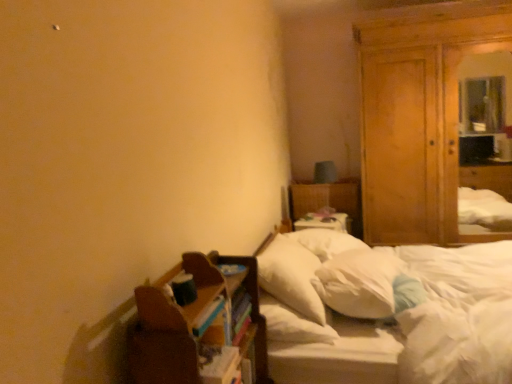
What do you see at coordinates (328, 201) in the screenshot?
I see `white fabric bed at center` at bounding box center [328, 201].

You are a GUI agent. You are given a task and a screenshot of the screen. Output one action in this format:
    pyautogui.click(x=<x>, y=<y>)
    Task: Click on the white soft mattress at center
    The image size is (512, 384).
    Given the screenshot: What is the action you would take?
    pyautogui.click(x=459, y=315)

The image size is (512, 384). Identify the location of white soft bed at center. (390, 311).

What do you see at coordinates (224, 319) in the screenshot? The image size is (512, 384). I see `multicolored paper book at center` at bounding box center [224, 319].

Where is `white fabric bed at center`? white fabric bed at center is located at coordinates (328, 201).

Considering the sizes of objects white soft bed at center and white fabric bed at center in the image provided, who is taller, white soft bed at center or white fabric bed at center?

With more height is white soft bed at center.

Looking at this image, in terms of width, does white soft bed at center look wider or thinner when compared to white fabric bed at center?

Clearly, white soft bed at center has more width compared to white fabric bed at center.

From a real-world perspective, who is located lower, white soft bed at center or white fabric bed at center?

white soft bed at center is physically lower.

Is white soft bed at center at the left side of white fabric bed at center?

Incorrect, white soft bed at center is not on the left side of white fabric bed at center.

From the image's perspective, which is above, white soft mattress at center or multicolored paper book at center?

From the image's view, multicolored paper book at center is above.

Can you confirm if white soft mattress at center is wider than multicolored paper book at center?

Correct, the width of white soft mattress at center exceeds that of multicolored paper book at center.

Is white soft mattress at center inside or outside of multicolored paper book at center?

white soft mattress at center is spatially situated outside multicolored paper book at center.

From a real-world perspective, is brown wooden shelf at lower left over white soft pillow at center, the 2th pillow viewed from the left?

Correct, in the physical world, brown wooden shelf at lower left is higher than white soft pillow at center, the 2th pillow viewed from the left.

Is brown wooden shelf at lower left shorter than white soft pillow at center, arranged as the 1th pillow when viewed from the right?

In fact, brown wooden shelf at lower left may be taller than white soft pillow at center, arranged as the 1th pillow when viewed from the right.

Based on their positions, is brown wooden shelf at lower left located to the left or right of white soft pillow at center, the 2th pillow viewed from the left?

brown wooden shelf at lower left is positioned on white soft pillow at center, the 2th pillow viewed from the left,'s left side.

Find the location of a particular element. The width and height of the screenshot is (512, 384). the 2nd pillow to the right of the brown wooden shelf at lower left, starting your count from the anchor is located at coordinates (360, 283).

Is brown wooden shelf at lower left positioned with its back to white fabric bed at center?

No, brown wooden shelf at lower left is not facing the opposite direction of white fabric bed at center.

Between brown wooden shelf at lower left and white fabric bed at center, which one has smaller width?

With smaller width is brown wooden shelf at lower left.

Identify the location of bed frame that appears below the brown wooden shelf at lower left (from a real-world perspective). The width and height of the screenshot is (512, 384). (328, 201).

From a real-world perspective, is brown wooden shelf at lower left physically located above or below white fabric bed at center?

brown wooden shelf at lower left is above white fabric bed at center.

Choose the correct answer: Is white soft pillow at center, the 2th pillow viewed from the left, inside brown wooden shelf at lower left or outside it?

white soft pillow at center, the 2th pillow viewed from the left, lies outside brown wooden shelf at lower left.

Is point (391, 284) positioned behind point (168, 335)?

That is True.

From a real-world perspective, which object rests below the other?

In real-world perspective, white soft pillow at center, arranged as the 1th pillow when viewed from the right, is lower.

At what (x,y) coordinates should I click in order to perform the action: click on pillow that is the 2nd one when counting backward from the white soft bed at center. Please return your answer as a coordinate pair (x, y). Looking at the image, I should click on (291, 277).

Between white soft bed at center and white soft pillow at center, which ranks as the second pillow in right-to-left order, which one has larger size?

Bigger between the two is white soft bed at center.

Is white soft bed at center located outside white soft pillow at center, which ranks as the second pillow in right-to-left order?

white soft bed at center is positioned outside white soft pillow at center, which ranks as the second pillow in right-to-left order.

From the picture: Is white soft pillow at center, which ranks as the second pillow in right-to-left order, taller than white soft mattress at center?

No.

Are white soft pillow at center, which is the first pillow from left to right, and white soft mattress at center located far from each other?

No.

Is point (317, 312) closer or farther from the camera than point (424, 255)?

Clearly, point (317, 312) is closer to the camera than point (424, 255).

Could you tell me if white soft pillow at center, which ranks as the second pillow in right-to-left order, is facing white soft mattress at center?

No, white soft pillow at center, which ranks as the second pillow in right-to-left order, is not turned towards white soft mattress at center.

Locate an element on the screen. Image resolution: width=512 pixels, height=384 pixels. bed in front of the white fabric bed at center is located at coordinates (390, 311).

What are the coordinates of `book above the white soft mattress at center (from the image's perspective)` in the screenshot? It's located at (224, 319).

Looking at the image, which one is located closer to white fabric bed at center, multicolored paper book at center or white soft bed at center?

white soft bed at center is positioned closer to the anchor white fabric bed at center.

Looking at the image, which one is located closer to wooden wardrobe at right, white fabric bed at center or white soft mattress at center?

Among the two, white fabric bed at center is located nearer to wooden wardrobe at right.

Estimate the real-world distances between objects in this image. Which object is further from white fabric bed at center, white soft pillow at center, the 2th pillow viewed from the left, or white soft mattress at center?

white soft pillow at center, the 2th pillow viewed from the left, is further to white fabric bed at center.

When comparing their distances from white soft mattress at center, does white soft bed at center or white fabric bed at center seem closer?

white soft bed at center is positioned closer to the anchor white soft mattress at center.

Considering their positions, is white soft pillow at center, which is the first pillow from left to right, positioned further to white soft mattress at center than white fabric bed at center?

white fabric bed at center.

Considering their positions, is white fabric bed at center positioned closer to white soft bed at center than brown wooden shelf at lower left?

brown wooden shelf at lower left lies closer to white soft bed at center than the other object.

When comparing their distances from multicolored paper book at center, does white soft pillow at center, the 2th pillow viewed from the left, or white soft pillow at center, which ranks as the second pillow in right-to-left order, seem closer?

Based on the image, white soft pillow at center, which ranks as the second pillow in right-to-left order, appears to be nearer to multicolored paper book at center.

Which object lies further to the anchor point white soft mattress at center, white soft pillow at center, arranged as the 1th pillow when viewed from the right, or white fabric bed at center?

white fabric bed at center is further to white soft mattress at center.

I want to click on pillow between white soft pillow at center, the 2th pillow viewed from the left, and white fabric bed at center in the front-back direction, so click(x=291, y=277).

Find the location of a particular element. The width and height of the screenshot is (512, 384). book between brown wooden shelf at lower left and wooden wardrobe at right from front to back is located at coordinates (224, 319).

Locate an element on the screen. bed between white soft pillow at center, which ranks as the second pillow in right-to-left order, and white soft mattress at center, in the horizontal direction is located at coordinates (390, 311).

I want to click on dresser positioned between white soft pillow at center, which ranks as the second pillow in right-to-left order, and white fabric bed at center from near to far, so click(x=418, y=119).